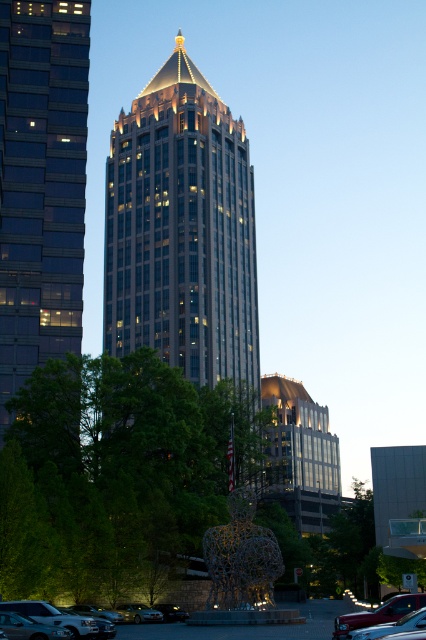
Between point (71, 614) and point (138, 611), which one is positioned in front?

Point (71, 614) is in front.

Measure the distance from silver metallic suv at lower left to metallic silver car at lower left.

silver metallic suv at lower left is 8.03 meters away from metallic silver car at lower left.

Is point (42, 621) positioned behind point (144, 611)?

That is False.

Where is `silver metallic suv at lower left`? silver metallic suv at lower left is located at coordinates (60, 618).

Between point (259, 637) and point (187, 616), which one is positioned in front?

Point (259, 637)

Between metallic gray cars at lower center and shiny silver car at lower center, which one appears on the right side from the viewer's perspective?

Positioned to the right is metallic gray cars at lower center.

At what (x,y) coordinates should I click in order to perform the action: click on metallic gray cars at lower center. Please return your answer as a coordinate pair (x, y). The width and height of the screenshot is (426, 640). Looking at the image, I should click on (245, 627).

In the scene shown: Can you confirm if shiny glass skyscraper at center is positioned to the left of glassy reflective skyscraper at left?

Incorrect, shiny glass skyscraper at center is not on the left side of glassy reflective skyscraper at left.

Is shiny glass skyscraper at center wider than glassy reflective skyscraper at left?

Yes, shiny glass skyscraper at center is wider than glassy reflective skyscraper at left.

Which is behind, point (187, 109) or point (68, 276)?

Positioned behind is point (187, 109).

The width and height of the screenshot is (426, 640). Find the location of `shiny glass skyscraper at center`. shiny glass skyscraper at center is located at coordinates (181, 230).